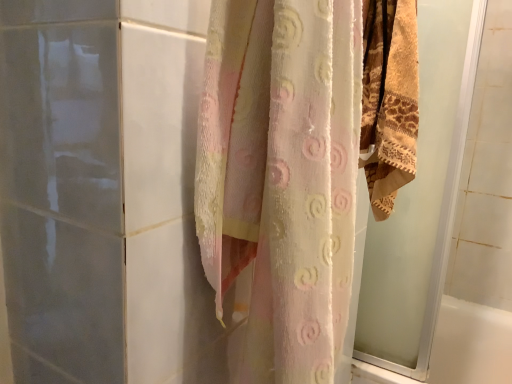
Question: From the image's perspective, is beige textured towel at right positioned above or below translucent floral curtain at center?

Choices:
 (A) above
 (B) below

Answer: (A)

Question: Do you think beige textured towel at right is within translucent floral curtain at center, or outside of it?

Choices:
 (A) inside
 (B) outside

Answer: (B)

Question: Considering the positions of beige textured towel at right and translucent floral curtain at center in the image, is beige textured towel at right wider or thinner than translucent floral curtain at center?

Choices:
 (A) thin
 (B) wide

Answer: (A)

Question: From the image's perspective, is translucent floral curtain at center positioned above or below beige textured towel at right?

Choices:
 (A) below
 (B) above

Answer: (A)

Question: Considering the positions of translucent floral curtain at center and beige textured towel at right in the image, is translucent floral curtain at center taller or shorter than beige textured towel at right?

Choices:
 (A) short
 (B) tall

Answer: (B)

Question: From a real-world perspective, is translucent floral curtain at center physically located above or below beige textured towel at right?

Choices:
 (A) above
 (B) below

Answer: (B)

Question: Relative to beige textured towel at right, is translucent floral curtain at center in front or behind?

Choices:
 (A) behind
 (B) front

Answer: (B)